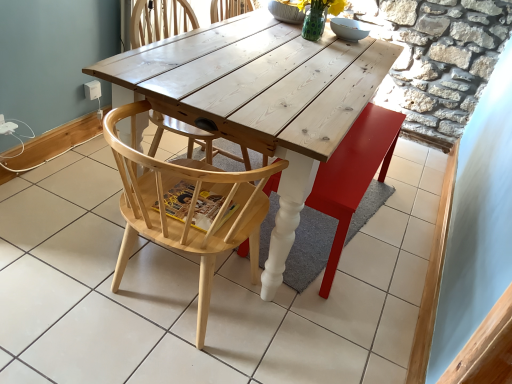
Where is `vacant position to the left of natural wood chair at center, which is the second chair in front-to-back order`? vacant position to the left of natural wood chair at center, which is the second chair in front-to-back order is located at coordinates (84, 178).